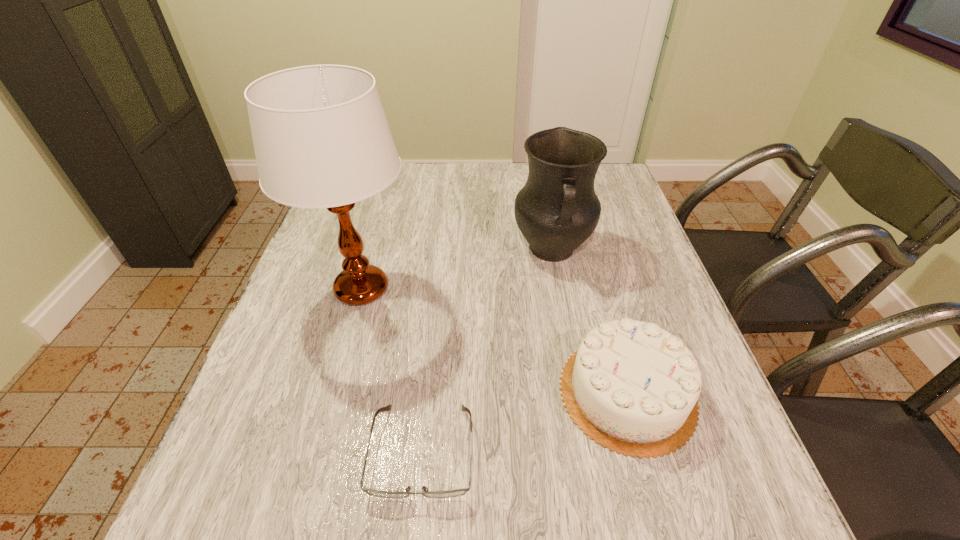
Locate an element on the screen. Image resolution: width=960 pixels, height=540 pixels. the tallest object is located at coordinates (321, 138).

Find the location of `pitcher`. pitcher is located at coordinates (557, 210).

Find the location of `the second shortest object`. the second shortest object is located at coordinates (633, 387).

Locate an element on the screen. The image size is (960, 540). the shortest object is located at coordinates (459, 492).

The width and height of the screenshot is (960, 540). I want to click on vacant region located 0.230m on the front of the tallest object, so click(x=323, y=429).

This screenshot has height=540, width=960. I want to click on free space located 0.070m on the handle side of the pitcher, so click(562, 300).

Find the location of a particular element. Image resolution: width=960 pixels, height=540 pixels. blank space located on the left of the birthday cake is located at coordinates (400, 393).

The width and height of the screenshot is (960, 540). In order to click on object that is positioned at the near edge in this screenshot , I will do `click(459, 492)`.

Where is `object at the left edge`? The height and width of the screenshot is (540, 960). object at the left edge is located at coordinates (321, 138).

The image size is (960, 540). Find the location of `pitcher that is at the right edge`. pitcher that is at the right edge is located at coordinates (557, 210).